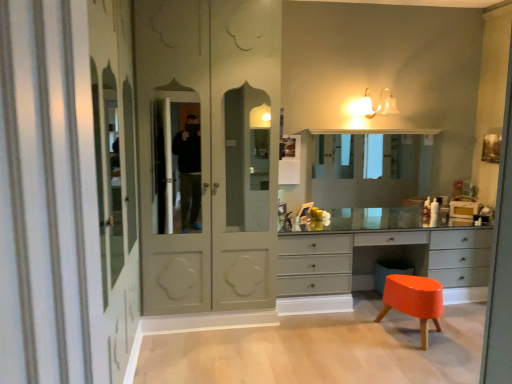
The height and width of the screenshot is (384, 512). In order to click on free spot in front of matte white wardrobe at center in this screenshot , I will do `click(229, 362)`.